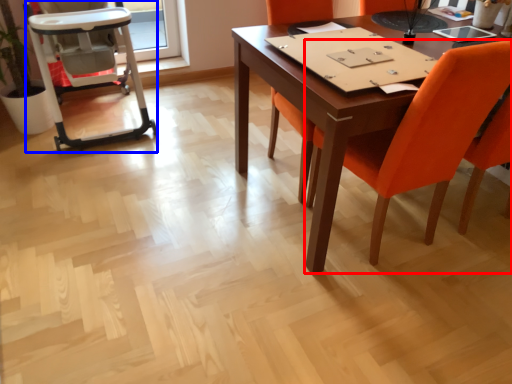
Question: Which point is further to the camera, chair (highlighted by a red box) or armchair (highlighted by a blue box)?

Choices:
 (A) chair
 (B) armchair

Answer: (B)